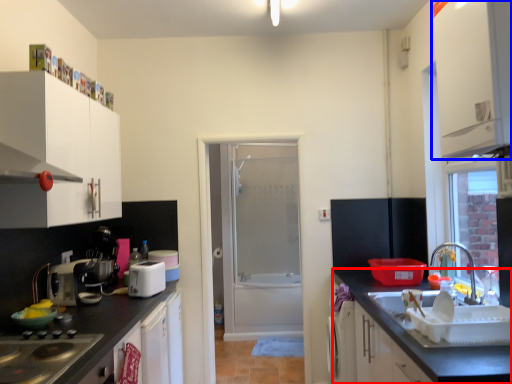
Question: Which object appears farthest to the camera in this image, countertop (highlighted by a red box) or cabinetry (highlighted by a blue box)?

Choices:
 (A) countertop
 (B) cabinetry

Answer: (B)